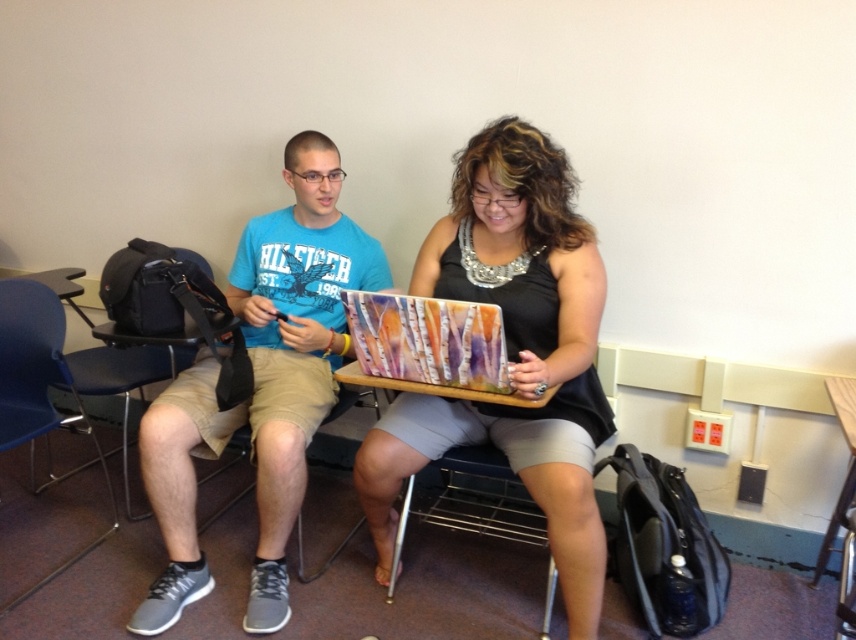
Who is more forward, (62, 566) or (477, 532)?

Positioned in front is point (62, 566).

Is point (79, 412) more distant than point (413, 476)?

Yes, it is.

Who is more distant from viewer, (25, 413) or (431, 504)?

Point (431, 504)

Locate an element on the screen. Image resolution: width=856 pixels, height=640 pixels. blue plastic chair at lower left is located at coordinates (37, 385).

Does point (510, 182) lie in front of point (7, 403)?

Yes, it is in front of point (7, 403).

Who is taller, metallic silver laptop at center or blue plastic chair at lower left?

With more height is metallic silver laptop at center.

Which is in front, point (360, 470) or point (51, 349)?

Positioned in front is point (360, 470).

This screenshot has height=640, width=856. I want to click on metallic silver laptop at center, so click(512, 353).

Which of these two, matte blue t-shirt at center or metallic silver chair at lower center, stands shorter?

With less height is metallic silver chair at lower center.

Image resolution: width=856 pixels, height=640 pixels. I want to click on matte blue t-shirt at center, so point(260,385).